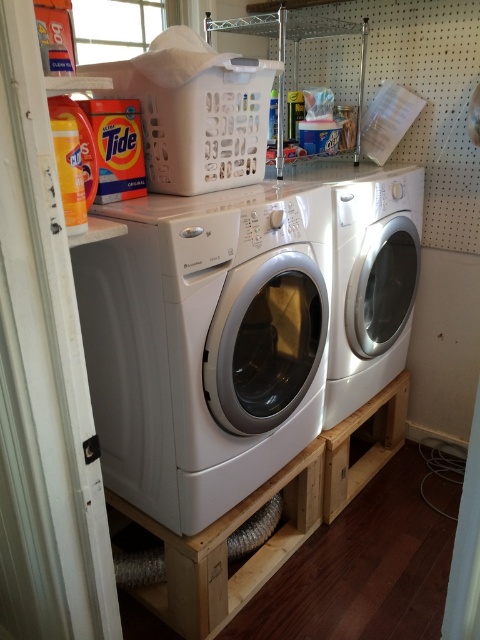
Question: Is white glossy washer at left closer to the viewer compared to white glossy washer at center?

Choices:
 (A) no
 (B) yes

Answer: (B)

Question: Which point appears farthest from the camera in this image?

Choices:
 (A) (254, 184)
 (B) (296, 541)

Answer: (B)

Question: Is white glossy washer at left to the left of white glossy washer at center from the viewer's perspective?

Choices:
 (A) yes
 (B) no

Answer: (A)

Question: Which point is closer to the camera?

Choices:
 (A) white glossy washer at left
 (B) white glossy washer at center
 (C) wooden pallet at lower center

Answer: (A)

Question: Is white glossy washer at left closer to the viewer compared to wooden pallet at lower center?

Choices:
 (A) no
 (B) yes

Answer: (B)

Question: Which object appears farthest from the camera in this image?

Choices:
 (A) wooden pallet at lower center
 (B) white glossy washer at left

Answer: (A)